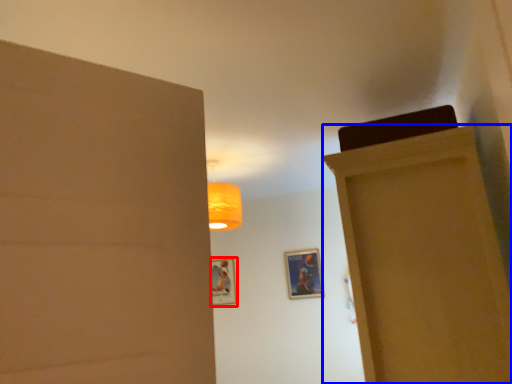
Question: Which point is closer to the camera, picture frame (highlighted by a red box) or door (highlighted by a blue box)?

Choices:
 (A) picture frame
 (B) door

Answer: (B)